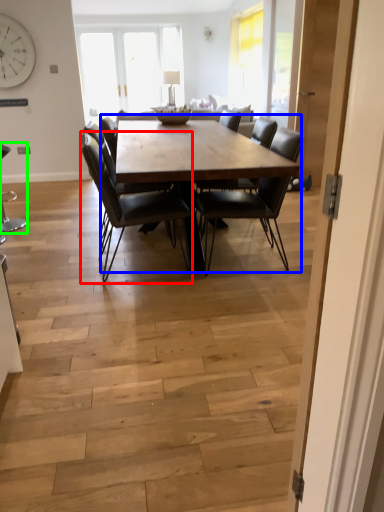
Question: Estimate the real-world distances between objects in this image. Which object is closer to chair (highlighted by a red box), coffee table (highlighted by a blue box) or chair (highlighted by a green box)?

Choices:
 (A) coffee table
 (B) chair

Answer: (A)